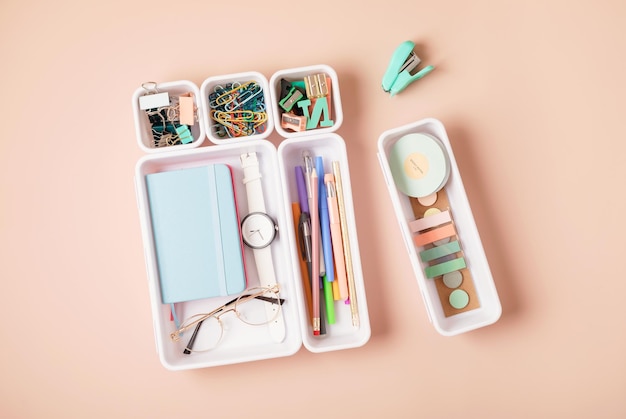
I want to click on compartments, so click(x=228, y=334), click(x=334, y=302), click(x=452, y=262), click(x=304, y=111), click(x=228, y=108), click(x=170, y=121).